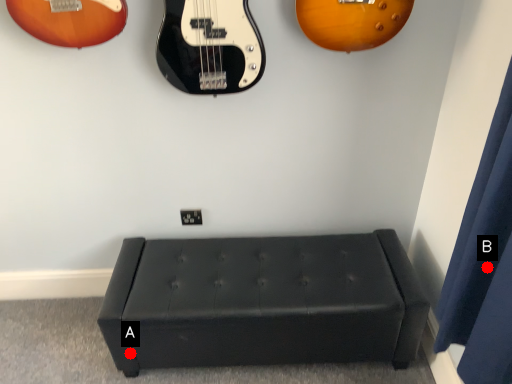
Question: Two points are circled on the image, labeled by A and B beside each circle. Which point appears farthest from the camera in this image?

Choices:
 (A) A is further
 (B) B is further

Answer: (A)